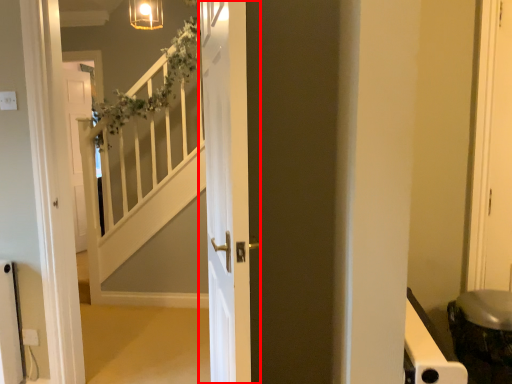
Question: Considering the relative positions of door (annotated by the red box) and electric outlet in the image provided, where is door (annotated by the red box) located with respect to the staircase?

Choices:
 (A) left
 (B) right

Answer: (B)